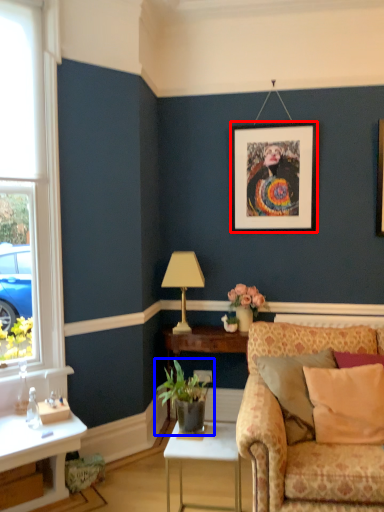
Question: Which object is further to the camera taking this photo, picture frame (highlighted by a red box) or houseplant (highlighted by a blue box)?

Choices:
 (A) picture frame
 (B) houseplant

Answer: (A)